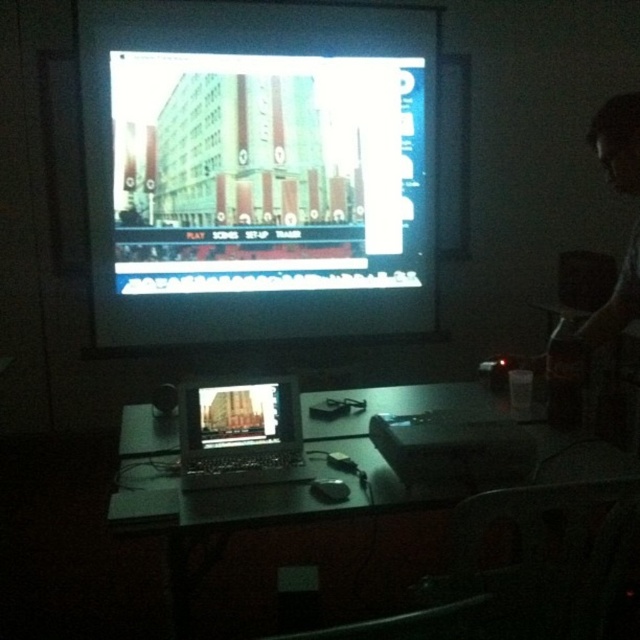
Question: Is bright glossy screen at upper center above black plastic laptop at center?

Choices:
 (A) no
 (B) yes

Answer: (B)

Question: Estimate the real-world distances between objects in this image. Which object is farther from the bright glossy screen at upper center?

Choices:
 (A) black plastic laptop at center
 (B) matte silver laptop at center
 (C) metallic silver laptop at lower center

Answer: (B)

Question: Considering the relative positions of black plastic laptop at center and matte silver laptop at center in the image provided, where is black plastic laptop at center located with respect to matte silver laptop at center?

Choices:
 (A) above
 (B) below

Answer: (B)

Question: Does metallic silver laptop at lower center have a smaller size compared to black plastic laptop at center?

Choices:
 (A) no
 (B) yes

Answer: (A)

Question: Estimate the real-world distances between objects in this image. Which object is closer to the black plastic laptop at center?

Choices:
 (A) bright glossy screen at upper center
 (B) matte silver laptop at center
 (C) metallic silver laptop at lower center

Answer: (B)

Question: Among these objects, which one is nearest to the camera?

Choices:
 (A) bright glossy screen at upper center
 (B) black plastic laptop at center
 (C) matte silver laptop at center

Answer: (B)